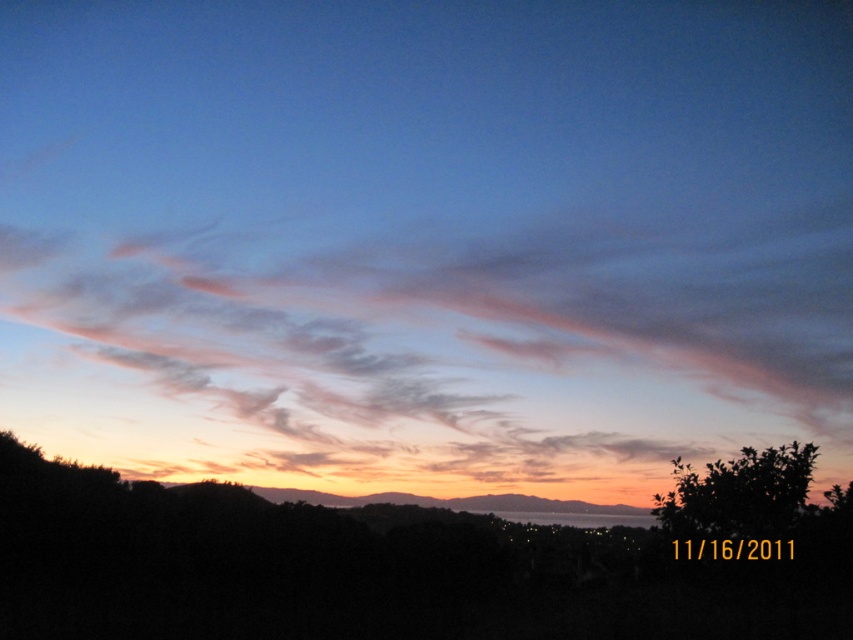
Question: Is pink translucent clouds at upper center smaller than green leafy tree at lower right?

Choices:
 (A) yes
 (B) no

Answer: (B)

Question: Which point is closer to the camera taking this photo?

Choices:
 (A) (543, 381)
 (B) (840, 499)

Answer: (B)

Question: From the image, what is the correct spatial relationship of pink translucent clouds at upper center in relation to green leafy tree at lower right?

Choices:
 (A) right
 (B) left

Answer: (B)

Question: Can you confirm if pink translucent clouds at upper center is smaller than green leafy tree at lower right?

Choices:
 (A) yes
 (B) no

Answer: (B)

Question: Which object appears closest to the camera in this image?

Choices:
 (A) green leafy tree at lower right
 (B) pink translucent clouds at upper center

Answer: (A)

Question: Which of the following is the farthest from the observer?

Choices:
 (A) pink translucent clouds at upper center
 (B) green leafy tree at lower right

Answer: (A)